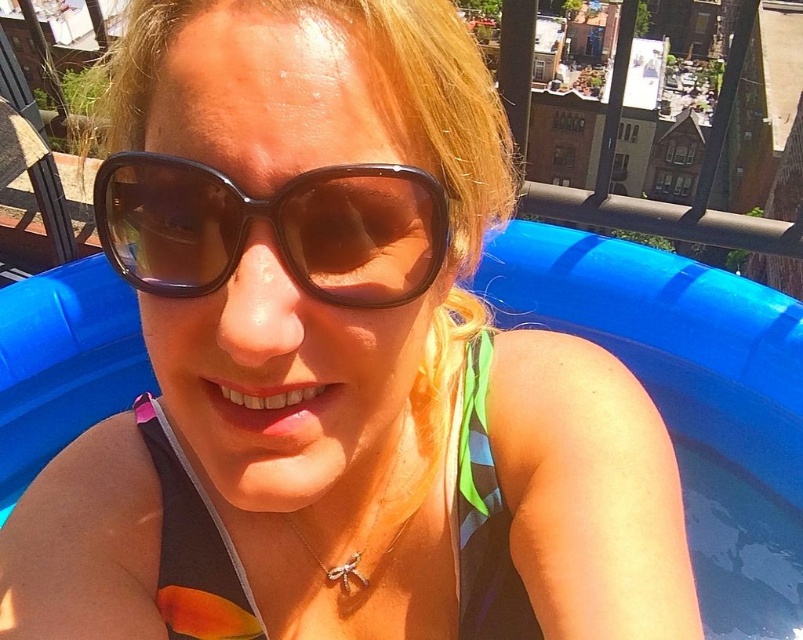
Between brown shiny sunglasses at center and black matte bikini top at center, which one has more height?

black matte bikini top at center

Looking at this image, is brown shiny sunglasses at center to the left of black matte bikini top at center from the viewer's perspective?

Indeed, brown shiny sunglasses at center is positioned on the left side of black matte bikini top at center.

The height and width of the screenshot is (640, 803). I want to click on brown shiny sunglasses at center, so click(272, 228).

Locate an element on the screen. brown shiny sunglasses at center is located at coordinates (272, 228).